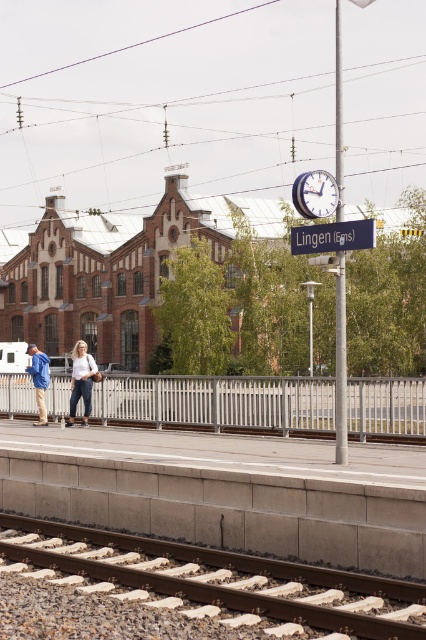
Question: Which object is positioned closest to the brown wooden track at lower center?

Choices:
 (A) gray metallic rail at center
 (B) blue denim jacket at left
 (C) matte blue jacket at center

Answer: (A)

Question: Which object is farther from the camera taking this photo?

Choices:
 (A) gray metallic rail at center
 (B) denim pants at center
 (C) brown wooden track at lower center
 (D) blue denim jacket at left

Answer: (D)

Question: Where is denim pants at center located in relation to blue denim jacket at left in the image?

Choices:
 (A) right
 (B) left

Answer: (A)

Question: Does gray metallic rail at center appear under matte blue jacket at center?

Choices:
 (A) yes
 (B) no

Answer: (A)

Question: Considering the real-world distances, which object is farthest from the brown wooden track at lower center?

Choices:
 (A) matte blue jacket at center
 (B) gray metallic rail at center
 (C) blue denim jacket at left
 (D) denim pants at center

Answer: (C)

Question: Is brown wooden track at lower center positioned before denim pants at center?

Choices:
 (A) yes
 (B) no

Answer: (A)